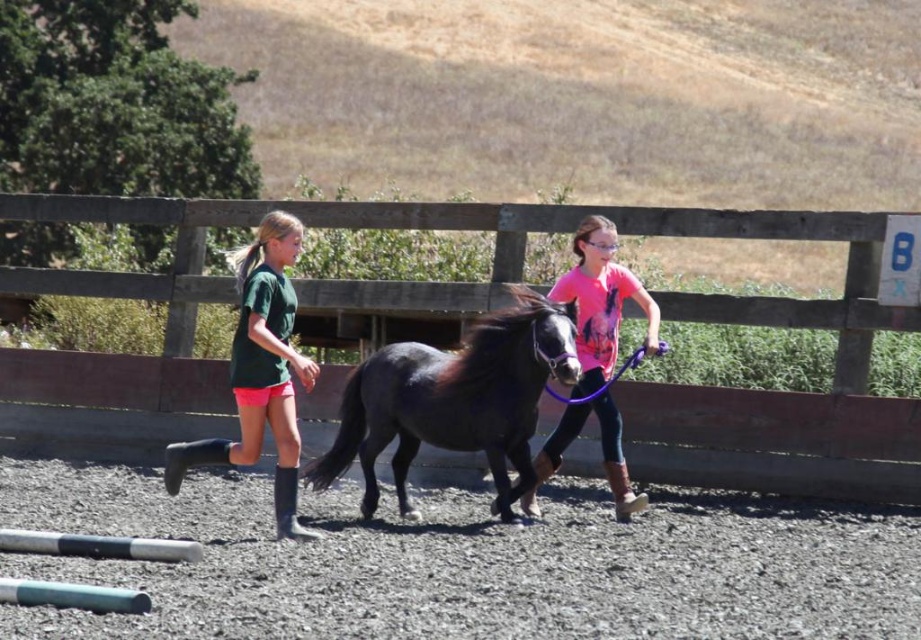
Question: Which of the following is the closest to the observer?

Choices:
 (A) green matte shorts at center
 (B) shiny black horse at center

Answer: (A)

Question: Does wooden fence at center have a larger size compared to shiny black horse at center?

Choices:
 (A) yes
 (B) no

Answer: (B)

Question: Observing the image, what is the correct spatial positioning of gray gravel at center in reference to green matte shorts at center?

Choices:
 (A) above
 (B) below

Answer: (B)

Question: Which object appears closest to the camera in this image?

Choices:
 (A) shiny black horse at center
 (B) wooden fence at center
 (C) green matte shorts at center
 (D) gray gravel at center

Answer: (D)

Question: Estimate the real-world distances between objects in this image. Which object is farther from the wooden fence at center?

Choices:
 (A) green matte shorts at center
 (B) pink fabric shirt at center
 (C) shiny black horse at center

Answer: (A)

Question: Does gray gravel at center have a smaller size compared to shiny black horse at center?

Choices:
 (A) no
 (B) yes

Answer: (B)